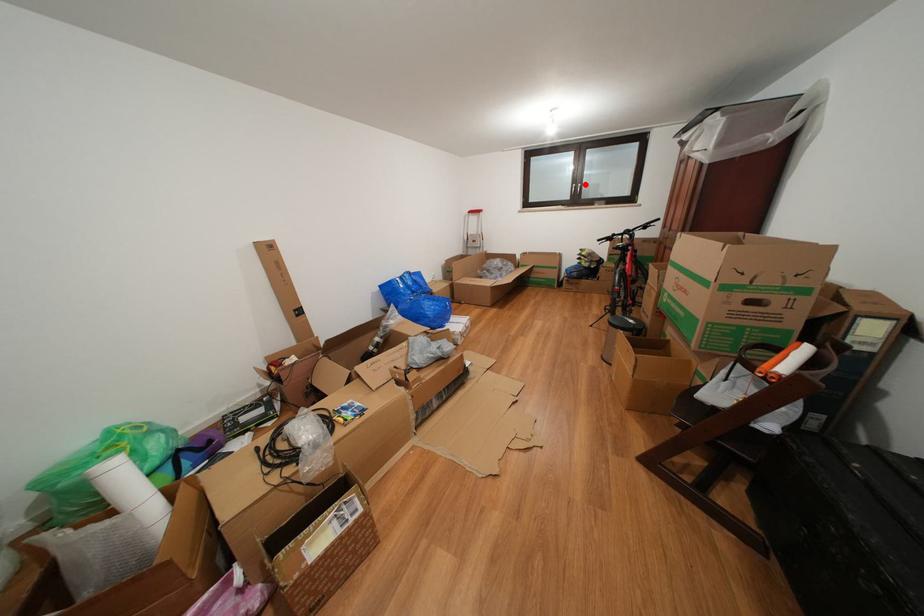
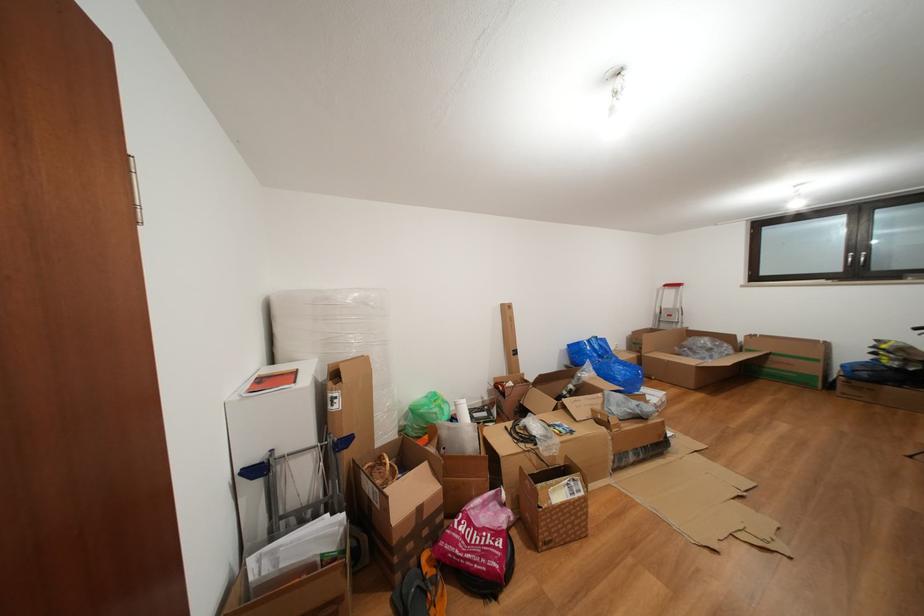
Where in the second image is the point corresponding to the highlighted location from the first image?

(866, 252)